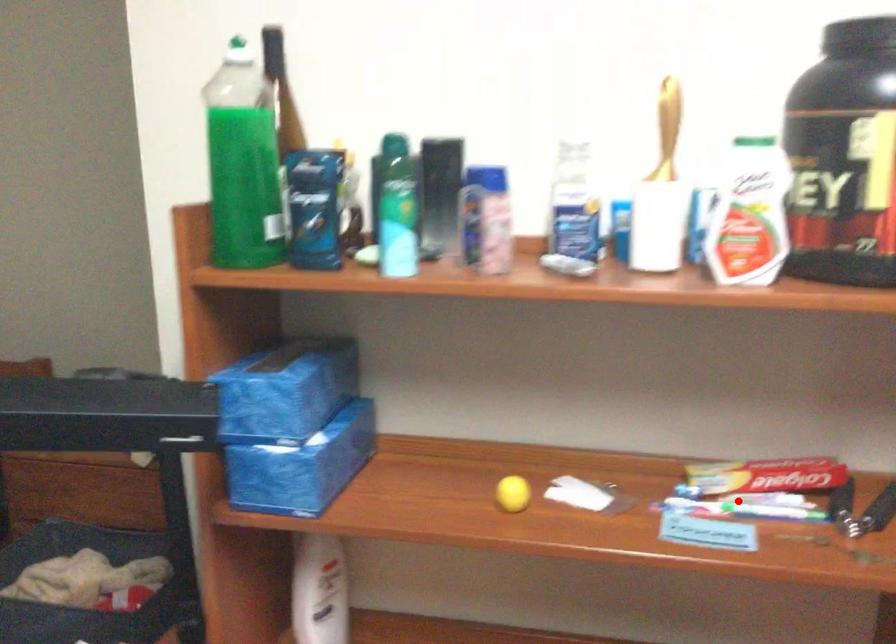
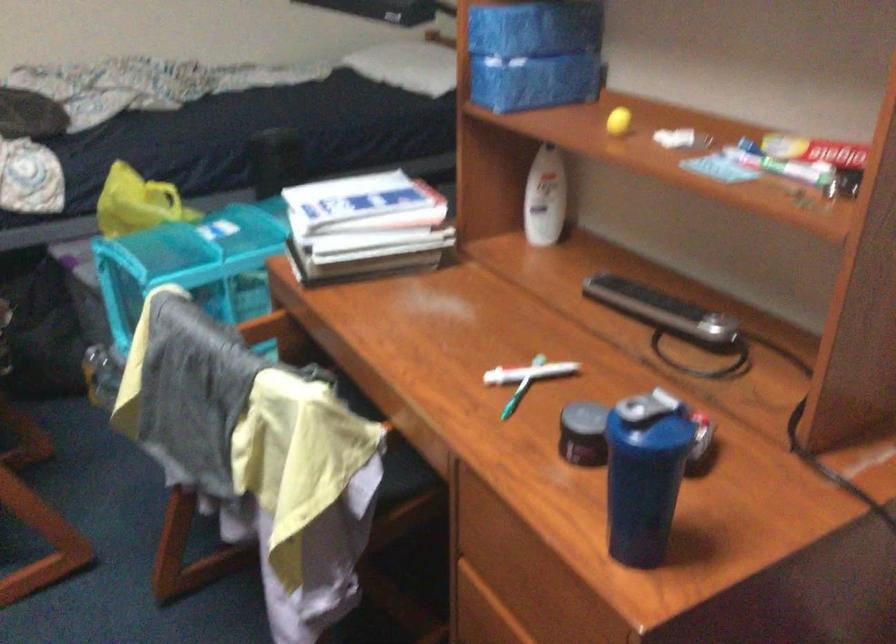
Locate, in the second image, the point that corresponds to the highlighted location in the first image.

(780, 164)